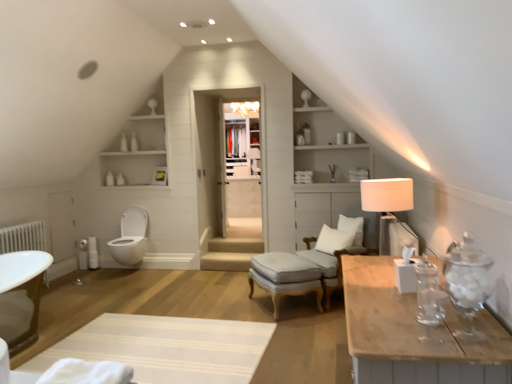
Where is `blank space situated above white textured rug at lower center (from a real-world perspective)`? This screenshot has width=512, height=384. blank space situated above white textured rug at lower center (from a real-world perspective) is located at coordinates [170, 341].